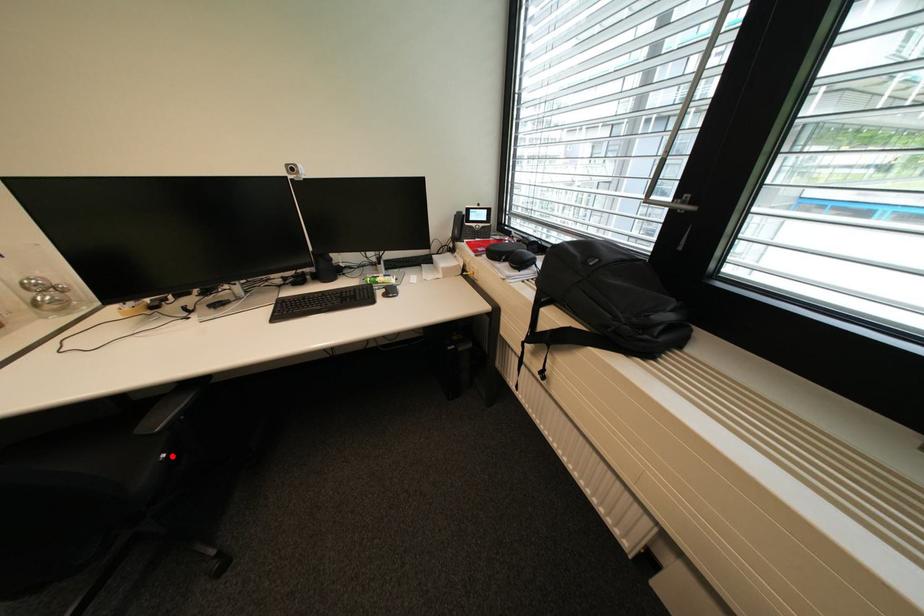
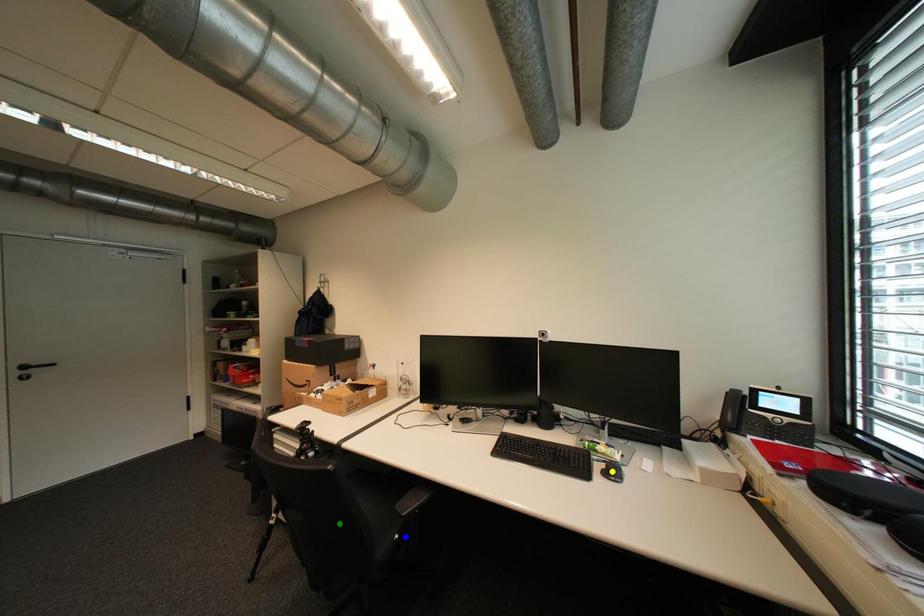
Question: I am providing you with two images of the same scene from different viewpoints. A red point is marked on the first image. You are given multiple points on the second image. Which point in image 2 represents the same 3d spot as the red point in image 1?

Choices:
 (A) blue point
 (B) yellow point
 (C) green point

Answer: (A)